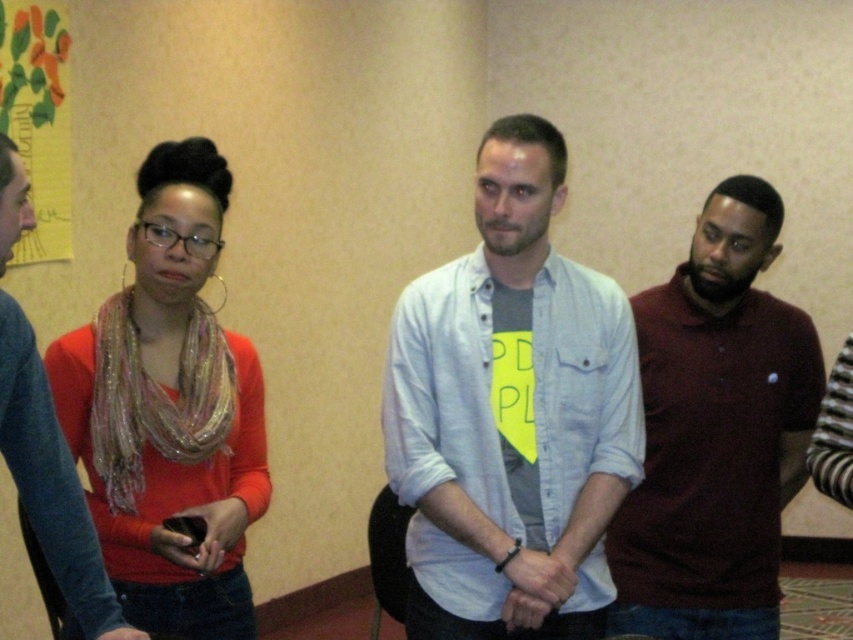
Describe the element at coordinates (169, 410) in the screenshot. I see `matte orange sweater at left` at that location.

Is matte orange sweater at left above maroon polo shirt at right?

Yes, matte orange sweater at left is above maroon polo shirt at right.

The height and width of the screenshot is (640, 853). Find the location of `matte orange sweater at left`. matte orange sweater at left is located at coordinates (169, 410).

In the scene shown: Is light blue denim shirt at center positioned at the back of matte orange sweater at left?

Yes, it is.

This screenshot has width=853, height=640. Find the location of `light blue denim shirt at center`. light blue denim shirt at center is located at coordinates (511, 413).

Between point (537, 380) and point (231, 516), which one is positioned behind?

Positioned behind is point (537, 380).

Locate an element on the screen. Image resolution: width=853 pixels, height=640 pixels. light blue denim shirt at center is located at coordinates (511, 413).

Find the location of `light blue denim shirt at center`. light blue denim shirt at center is located at coordinates (511, 413).

Can you confirm if light blue denim shirt at center is taller than maroon polo shirt at right?

Indeed, light blue denim shirt at center has a greater height compared to maroon polo shirt at right.

This screenshot has width=853, height=640. In order to click on light blue denim shirt at center in this screenshot , I will do `click(511, 413)`.

Image resolution: width=853 pixels, height=640 pixels. Identify the location of light blue denim shirt at center. (511, 413).